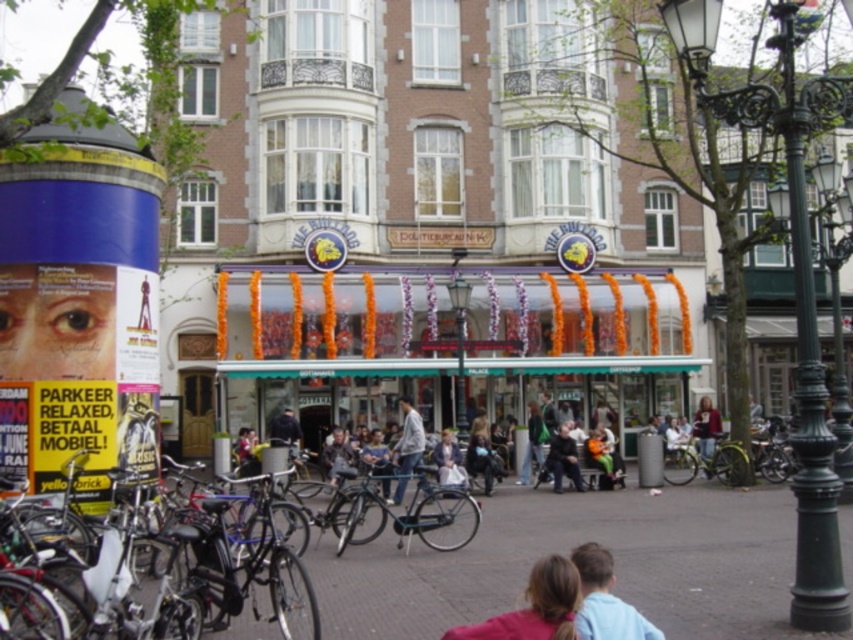
Question: Which point is farther from the camera taking this photo?

Choices:
 (A) (717, 554)
 (B) (346, 461)
 (C) (561, 476)

Answer: (B)

Question: Which is nearer to the green cast iron streetlight at center?

Choices:
 (A) silver metallic bicycle at lower left
 (B) concrete pavement at center

Answer: (B)

Question: Where is light gray jacket at center located in relation to light brown leather jacket at center in the image?

Choices:
 (A) above
 (B) below

Answer: (A)

Question: Which point is farther to the camera?

Choices:
 (A) (827, 465)
 (B) (456, 513)
 (C) (593, 570)
 (D) (573, 454)

Answer: (D)

Question: Can you confirm if silver metallic bicycle at lower left is bigger than light brown leather jacket at center?

Choices:
 (A) yes
 (B) no

Answer: (A)

Question: Can you confirm if concrete pavement at center is bigger than silver metallic bicycle at lower left?

Choices:
 (A) no
 (B) yes

Answer: (B)